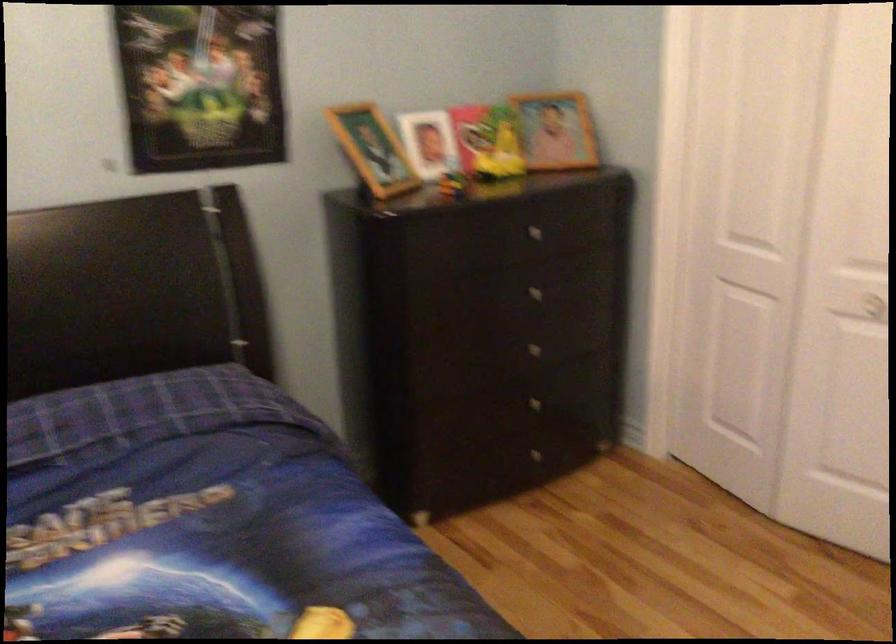
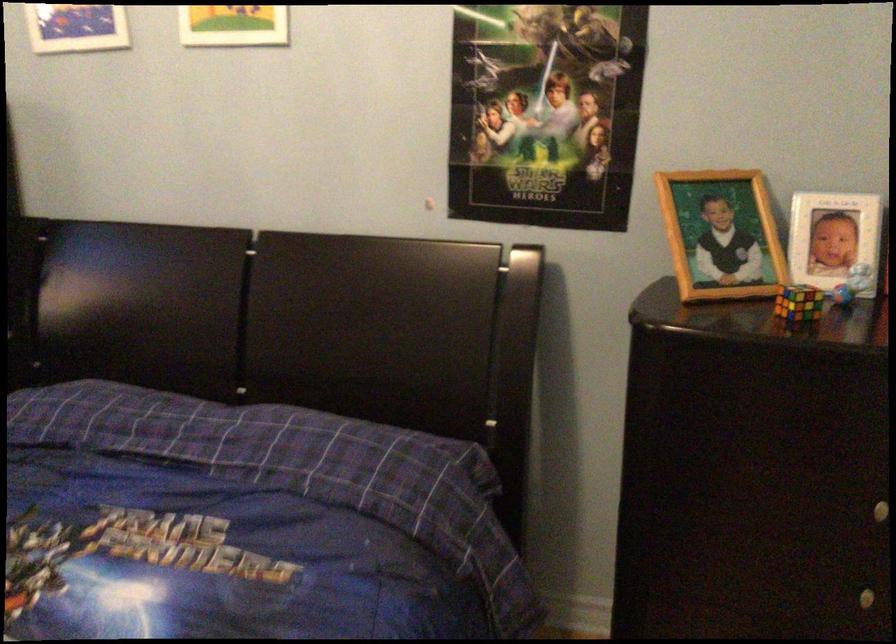
The point at (453, 176) is marked in the first image. Where is the corresponding point in the second image?

(798, 303)